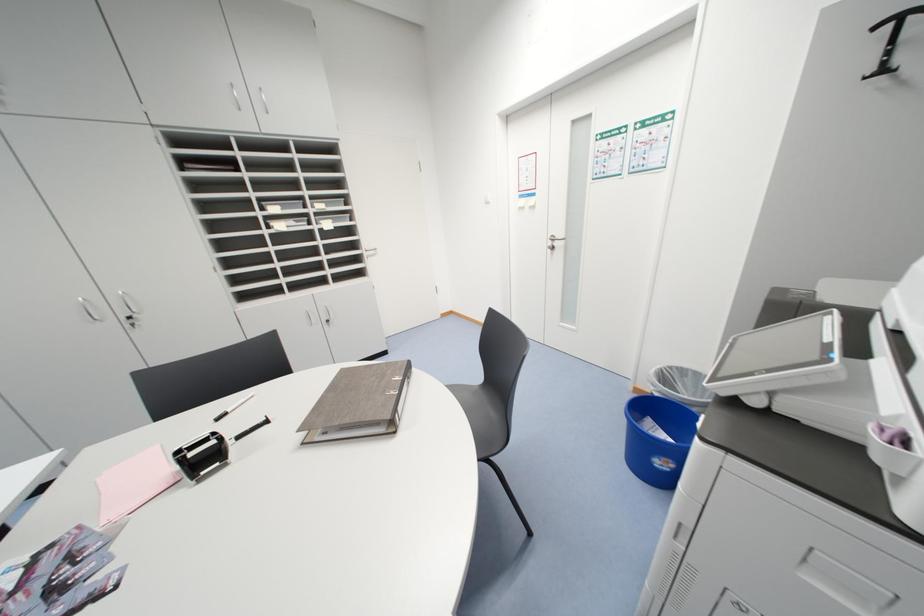
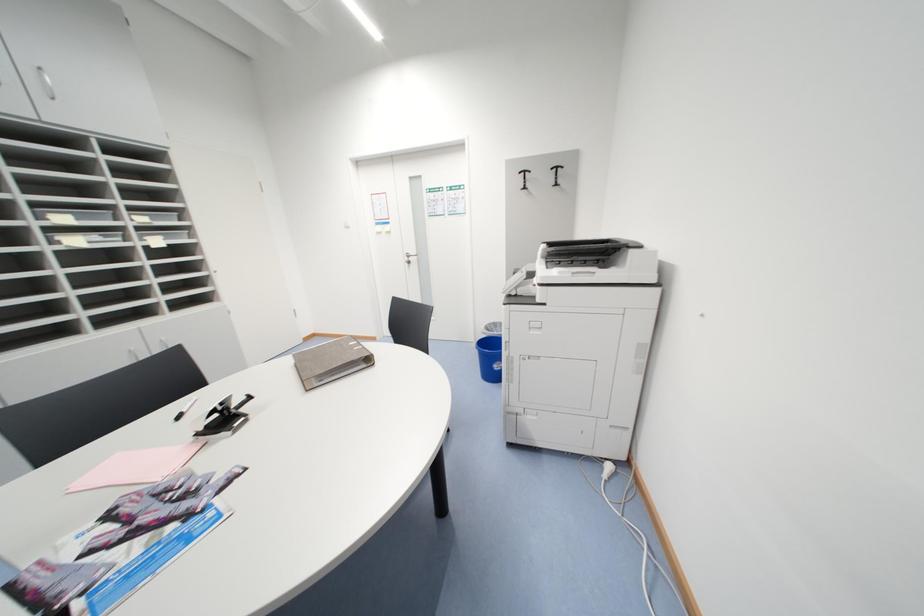
Question: The camera is either moving clockwise (left) or counter-clockwise (right) around the object. The first image is from the beginning of the video and the second image is from the end. Is the camera moving left or right when shooting the video?

Choices:
 (A) Left
 (B) Right

Answer: (A)